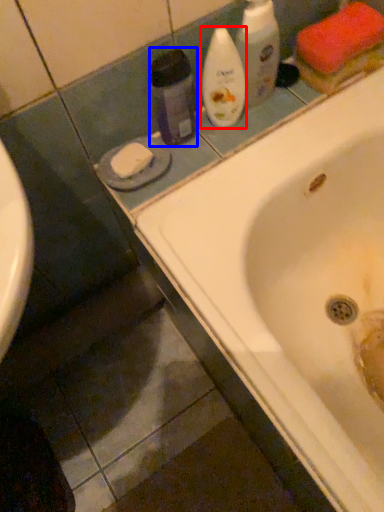
Question: Which object appears closest to the camera in this image, cleaning product (highlighted by a red box) or cleaning product (highlighted by a blue box)?

Choices:
 (A) cleaning product
 (B) cleaning product

Answer: (B)